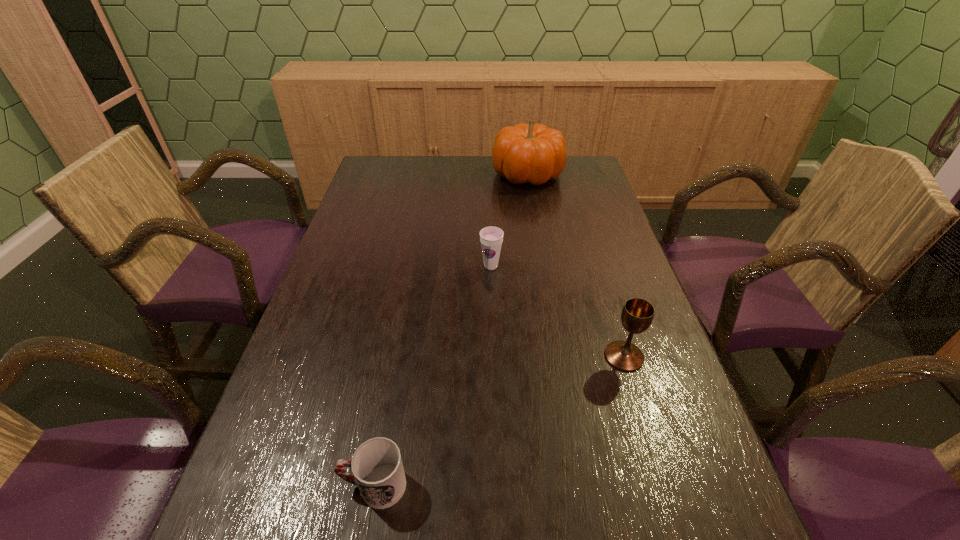
Identify the location of vacant space located 0.160m on the back of the farther cup. (490, 226).

The image size is (960, 540). I want to click on vacant space located on the handle side of the leftmost object, so click(252, 485).

Where is `free location located on the handle side of the leftmost object`? The height and width of the screenshot is (540, 960). free location located on the handle side of the leftmost object is located at coordinates (288, 485).

Locate an element on the screen. The height and width of the screenshot is (540, 960). free region located 0.080m on the handle side of the leftmost object is located at coordinates (295, 485).

Locate an element on the screen. object at the far edge is located at coordinates (534, 153).

In order to click on pumpkin situated at the right edge in this screenshot , I will do `click(534, 153)`.

Where is `chalice that is positioned at the right edge`? chalice that is positioned at the right edge is located at coordinates (637, 314).

This screenshot has width=960, height=540. I want to click on object situated at the far right corner, so click(534, 153).

What are the coordinates of `vacant space at the far edge of the desktop` in the screenshot? It's located at (422, 179).

The image size is (960, 540). In order to click on blank space at the left edge of the desktop in this screenshot , I will do `click(386, 221)`.